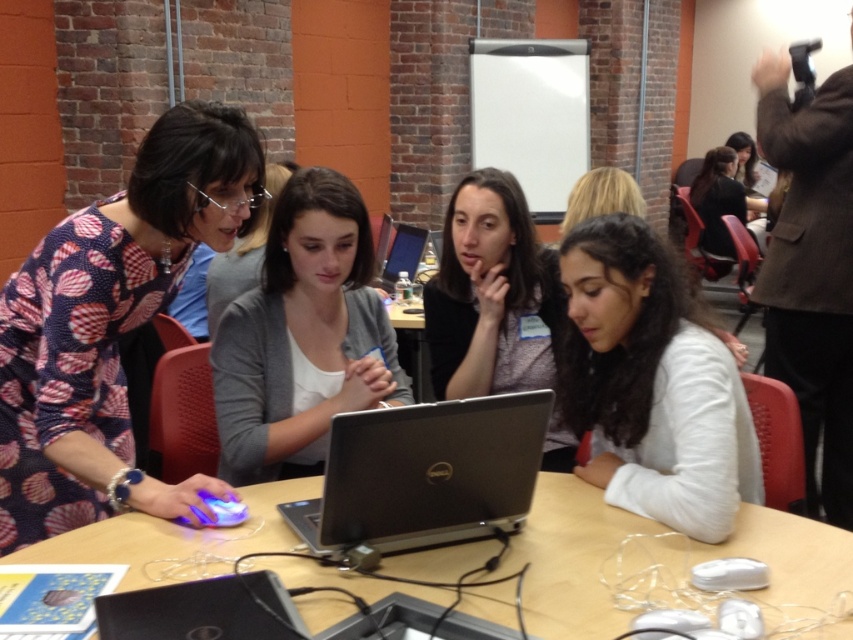
Question: Where is gray cardigan at center located in relation to matte black shirt at center in the image?

Choices:
 (A) above
 (B) below

Answer: (B)

Question: Which is nearer to the wooden table at center?

Choices:
 (A) gray cardigan at center
 (B) matte black shirt at center
 (C) white matte shirt at center
 (D) silver metallic laptop at center

Answer: (D)

Question: Which of the following is the farthest from the observer?

Choices:
 (A) (375, 332)
 (B) (741, 394)
 (C) (61, 524)

Answer: (A)

Question: Is wooden table at center below white matte shirt at center?

Choices:
 (A) yes
 (B) no

Answer: (A)

Question: Observing the image, what is the correct spatial positioning of white matte shirt at center in reference to matte black shirt at center?

Choices:
 (A) right
 (B) left

Answer: (A)

Question: Among these objects, which one is nearest to the camera?

Choices:
 (A) patterned fabric blouse at left
 (B) gray cardigan at center
 (C) wooden table at center

Answer: (C)